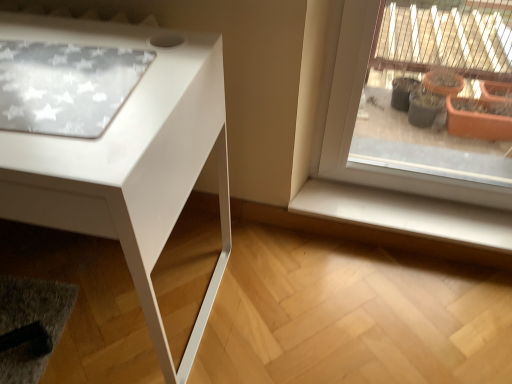
This screenshot has width=512, height=384. Describe the element at coordinates (128, 159) in the screenshot. I see `white glossy table at left` at that location.

At what (x,y) coordinates should I click in order to perform the action: click on white glossy table at left. Please return your answer as a coordinate pair (x, y). Image resolution: width=512 pixels, height=384 pixels. Looking at the image, I should click on (128, 159).

This screenshot has width=512, height=384. What do you see at coordinates (406, 213) in the screenshot?
I see `white smooth window sill at lower right` at bounding box center [406, 213].

The width and height of the screenshot is (512, 384). Identify the location of white smooth window sill at lower right. (406, 213).

Image resolution: width=512 pixels, height=384 pixels. Find the location of `white glossy table at left`. white glossy table at left is located at coordinates (128, 159).

Visually, is white glossy table at left positioned to the left or to the right of white smooth window sill at lower right?

Clearly, white glossy table at left is on the left of white smooth window sill at lower right in the image.

In the scene shown: Which object is further away from the camera, white glossy table at left or white smooth window sill at lower right?

white smooth window sill at lower right is more distant.

Considering the points (41, 203) and (335, 189), which point is behind, point (41, 203) or point (335, 189)?

The point (335, 189) is behind.

From the image's perspective, is white glossy table at left located above white smooth window sill at lower right?

Indeed, from the image's perspective, white glossy table at left is shown above white smooth window sill at lower right.

From a real-world perspective, which is physically above, white glossy table at left or white smooth window sill at lower right?

In real-world perspective, white glossy table at left is above.

From the picture: Considering the relative sizes of white glossy table at left and white smooth window sill at lower right in the image provided, is white glossy table at left thinner than white smooth window sill at lower right?

Incorrect, the width of white glossy table at left is not less than that of white smooth window sill at lower right.

Does white glossy table at left have a greater height compared to white smooth window sill at lower right?

Yes.

Who is bigger, white glossy table at left or white smooth window sill at lower right?

white glossy table at left is bigger.

Is white glossy table at left not within white smooth window sill at lower right?

Yes.

Is white glossy table at left with white smooth window sill at lower right?

No, white glossy table at left is not next to white smooth window sill at lower right.

Is white glossy table at left positioned with its back to white smooth window sill at lower right?

No, white glossy table at left is not facing away from white smooth window sill at lower right.

How much distance is there between white glossy table at left and white smooth window sill at lower right?

white glossy table at left and white smooth window sill at lower right are 26.57 inches apart from each other.

The height and width of the screenshot is (384, 512). What are the coordinates of `window sill on the right of white glossy table at left` in the screenshot? It's located at (406, 213).

Which is more to the right, white smooth window sill at lower right or white glossy table at left?

white smooth window sill at lower right.

Looking at this image, is white smooth window sill at lower right further to camera compared to white glossy table at left?

That is True.

Does point (373, 201) lie in front of point (220, 59)?

That is False.

From the image's perspective, is white smooth window sill at lower right beneath white glossy table at left?

Yes, from the image's perspective, white smooth window sill at lower right is below white glossy table at left.

From a real-world perspective, is white smooth window sill at lower right physically located above or below white glossy table at left?

Clearly, from a real-world perspective, white smooth window sill at lower right is below white glossy table at left.

In terms of width, does white smooth window sill at lower right look wider or thinner when compared to white glossy table at left?

In the image, white smooth window sill at lower right appears to be more narrow than white glossy table at left.

Which of these two, white smooth window sill at lower right or white glossy table at left, stands taller?

Standing taller between the two is white glossy table at left.

Considering the relative sizes of white smooth window sill at lower right and white glossy table at left in the image provided, is white smooth window sill at lower right bigger than white glossy table at left?

No, white smooth window sill at lower right is not bigger than white glossy table at left.

Is white smooth window sill at lower right not inside white glossy table at left?

Yes.

Are white smooth window sill at lower right and white glossy table at left located far from each other?

That's not correct — white smooth window sill at lower right is a little close to white glossy table at left.

Is white smooth window sill at lower right positioned with its back to white glossy table at left?

white smooth window sill at lower right does not have its back to white glossy table at left.

Looking at this image, how many degrees apart are the facing directions of white smooth window sill at lower right and white glossy table at left?

The facing directions of white smooth window sill at lower right and white glossy table at left are 2.39 degrees apart.

You are a GUI agent. You are given a task and a screenshot of the screen. Output one action in this format:
    pyautogui.click(x=<x>, y=<y>)
    Task: Click on the table above the white smooth window sill at lower right (from a real-world perspective)
    The image size is (512, 384).
    Given the screenshot: What is the action you would take?
    pyautogui.click(x=128, y=159)

Where is `table that appears in front of the white smooth window sill at lower right`? The image size is (512, 384). table that appears in front of the white smooth window sill at lower right is located at coordinates (128, 159).

In the image, there is a white glossy table at left. Where is `window sill below it (from a real-world perspective)`? The height and width of the screenshot is (384, 512). window sill below it (from a real-world perspective) is located at coordinates (406, 213).